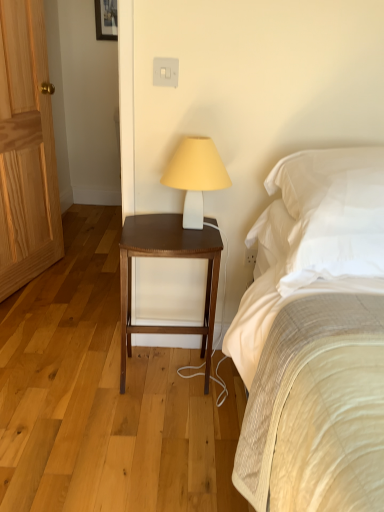
This screenshot has width=384, height=512. I want to click on vacant region above dark wood nightstand at center (from a real-world perspective), so click(174, 230).